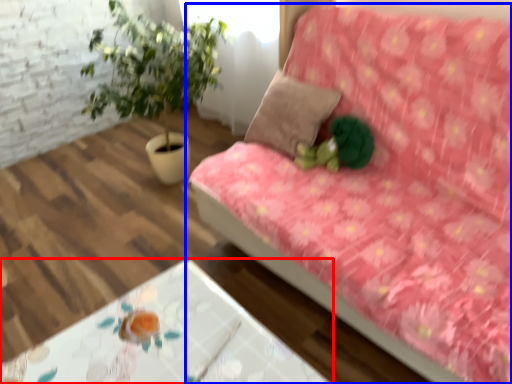
Question: Among these objects, which one is nearest to the camera, table (highlighted by a red box) or studio couch (highlighted by a blue box)?

Choices:
 (A) table
 (B) studio couch

Answer: (B)